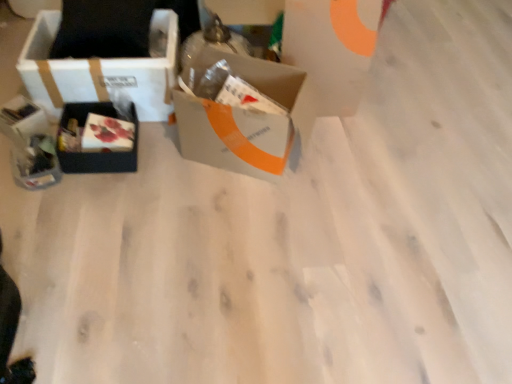
Locate an element on the screen. The width and height of the screenshot is (512, 384). vacant position to the left of gray cardboard box at center, the first box positioned from the right is located at coordinates (151, 173).